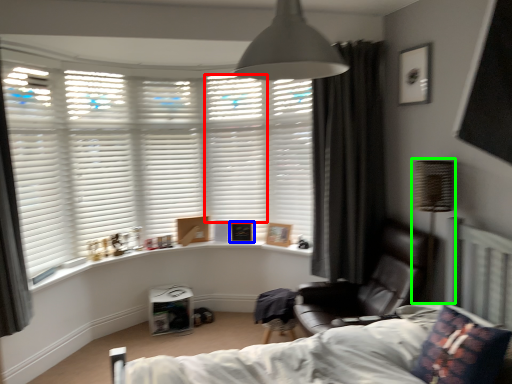
Question: Considering the real-world distances, which object is closest to shutter (highlighted by a red box)? picture frame (highlighted by a blue box) or table lamp (highlighted by a green box).

Choices:
 (A) picture frame
 (B) table lamp

Answer: (A)